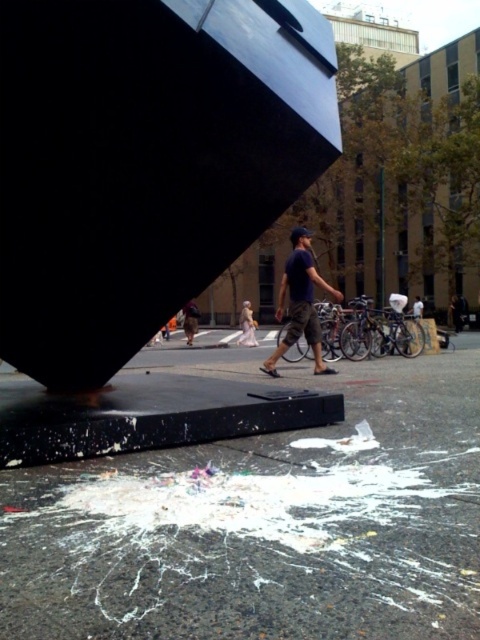
You are standing in the urban scene and want to take a photo of the granite at lower center and the light brown fabric dress at center. Which object should you adjust your camera to focus on first if you want to capture both in the same frame without moving the camera?

The granite at lower center is to the right of the light brown fabric dress at center, so you should focus on the light brown fabric dress at center first to ensure both are in the frame.